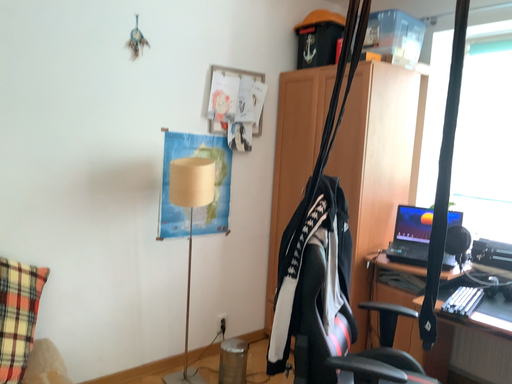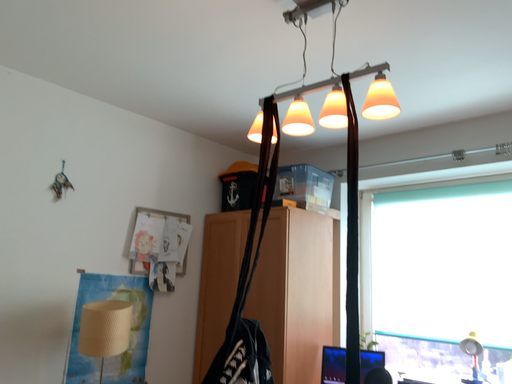
Question: Which way did the camera rotate in the video?

Choices:
 (A) rotated upward
 (B) rotated downward

Answer: (A)